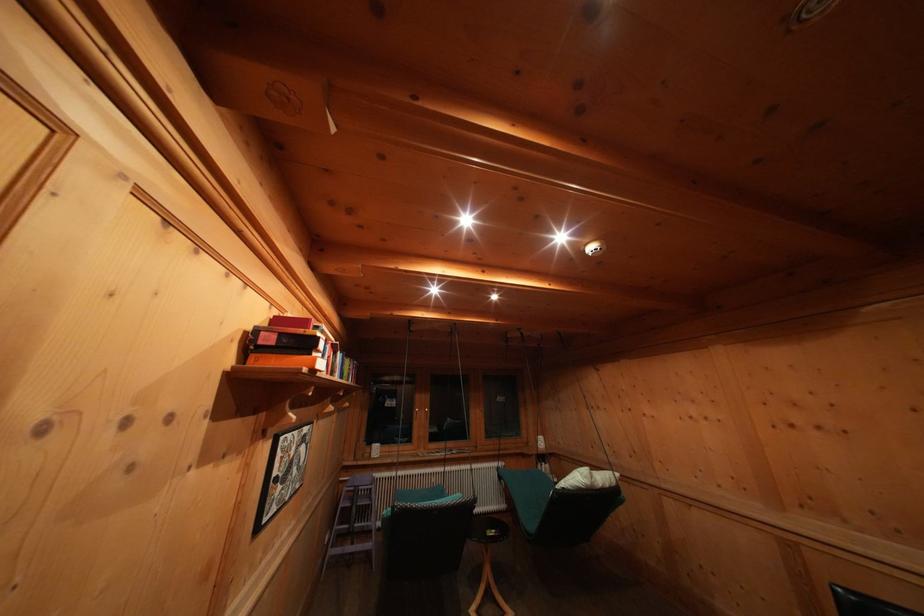
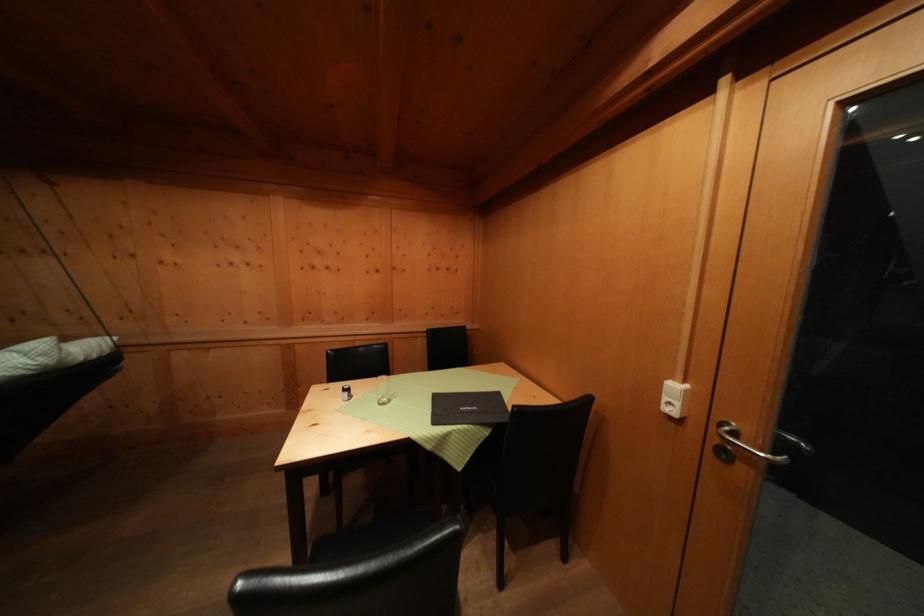
Question: The images are taken continuously from a first-person perspective. In which direction is your viewpoint rotating?

Choices:
 (A) Left
 (B) Right
 (C) Up
 (D) Down

Answer: (B)